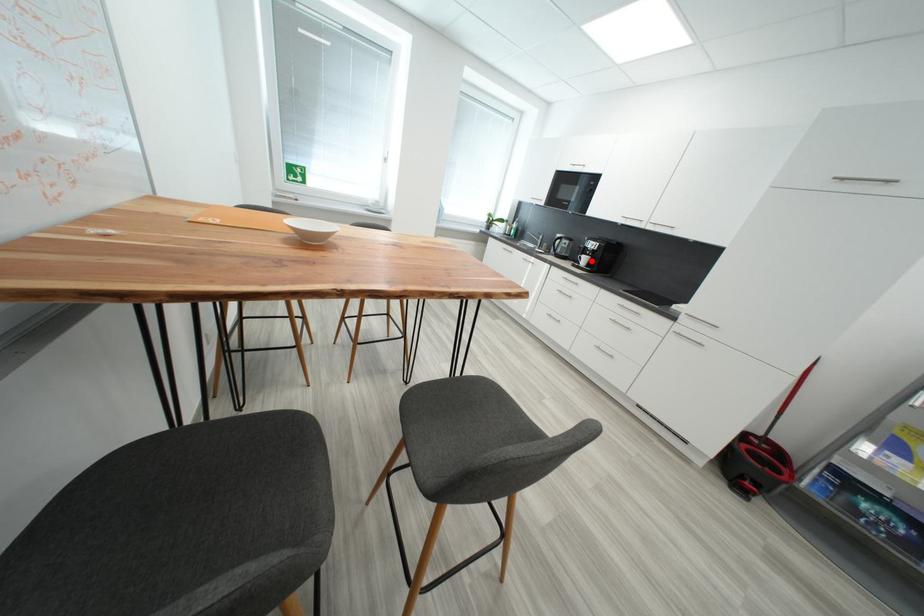
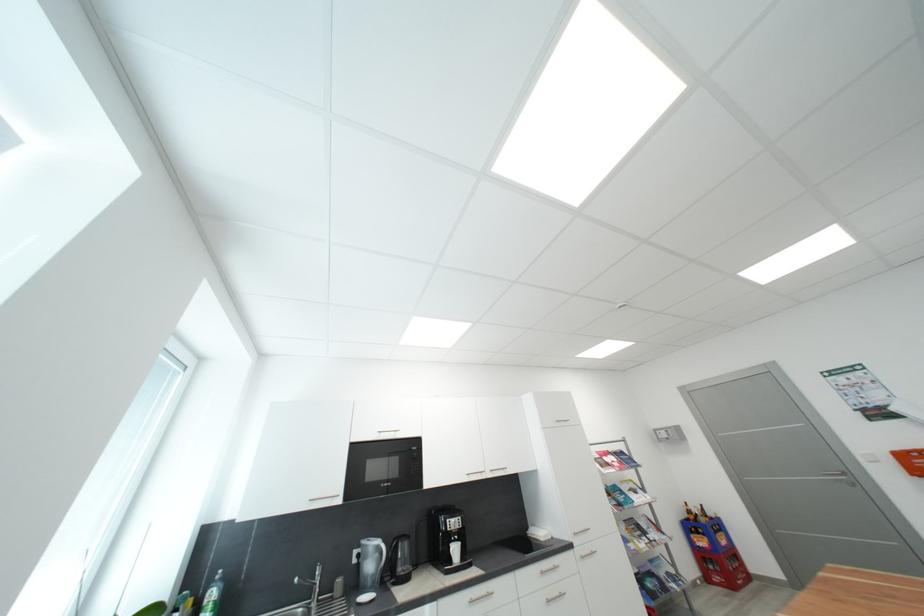
Question: I am providing you with two images of the same scene from different viewpoints. Image1 has a red point marked. In image2, the corresponding 3D location appears at what relative position? Reply with the corresponding letter.

Choices:
 (A) Closer
 (B) Farther

Answer: (B)